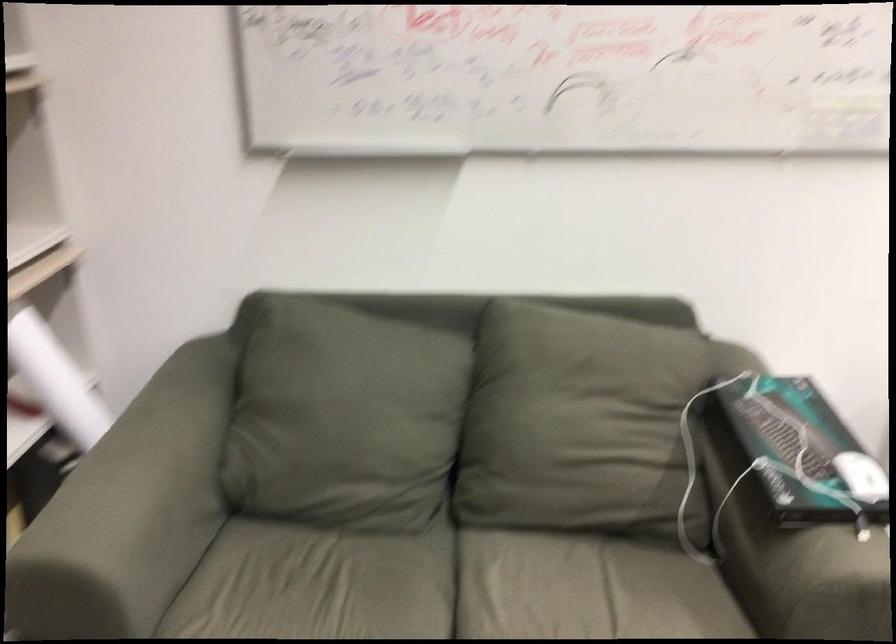
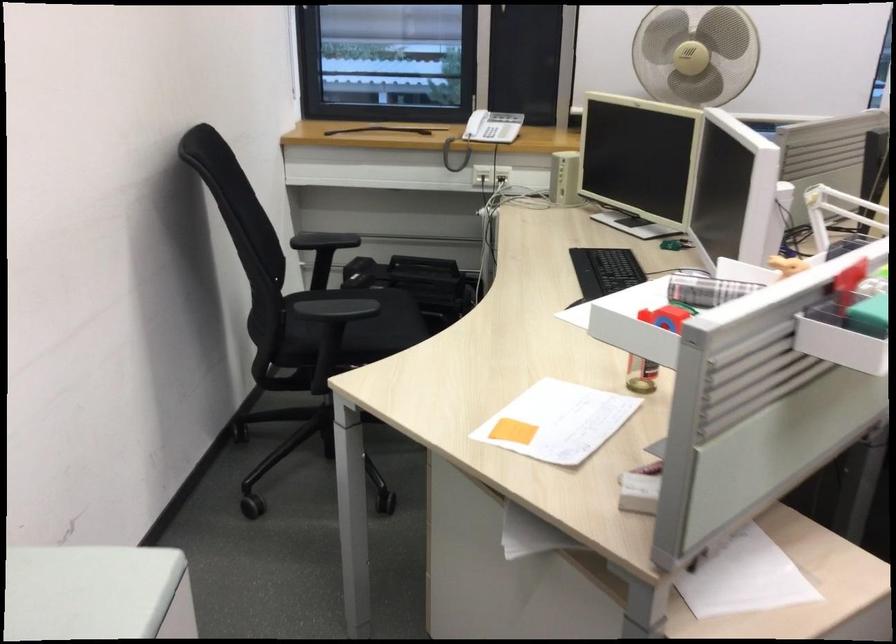
First-person continuous shooting, in which direction is the camera rotating?

The camera rotated toward right-down.